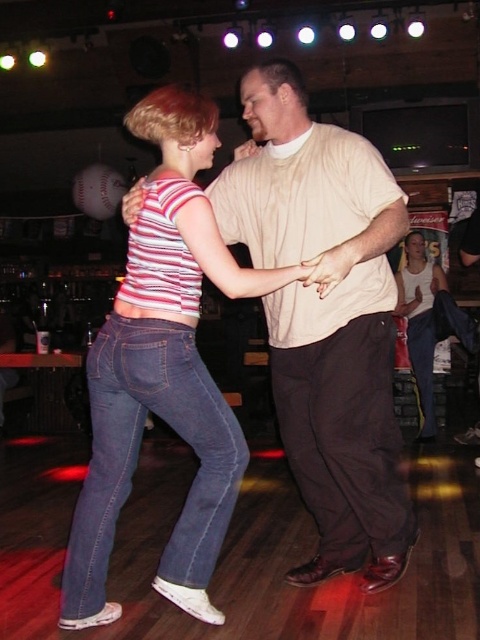
Between striped cotton tank top at center and white matte tank top at center, which one appears on the right side from the viewer's perspective?

From the viewer's perspective, white matte tank top at center appears more on the right side.

From the picture: Can you confirm if striped cotton tank top at center is positioned to the right of white matte tank top at center?

In fact, striped cotton tank top at center is to the left of white matte tank top at center.

Measure the distance between striped cotton tank top at center and camera.

The distance of striped cotton tank top at center from camera is 6.24 feet.

Identify the location of striped cotton tank top at center. (163, 371).

Measure the distance between point (85, 528) and camera.

2.16 meters

Who is more forward, (199, 298) or (479, 234)?

Point (199, 298)

At what (x,y) coordinates should I click in order to perform the action: click on striped cotton tank top at center. Please return your answer as a coordinate pair (x, y). This screenshot has width=480, height=640. Looking at the image, I should click on (163, 371).

Where is `denim jeans at lower left`? The height and width of the screenshot is (640, 480). denim jeans at lower left is located at coordinates (137, 454).

Which of these two, denim jeans at lower left or matte beige shirt at center, stands shorter?

With less height is matte beige shirt at center.

This screenshot has height=640, width=480. I want to click on denim jeans at lower left, so point(137,454).

The height and width of the screenshot is (640, 480). Identify the location of denim jeans at lower left. (137, 454).